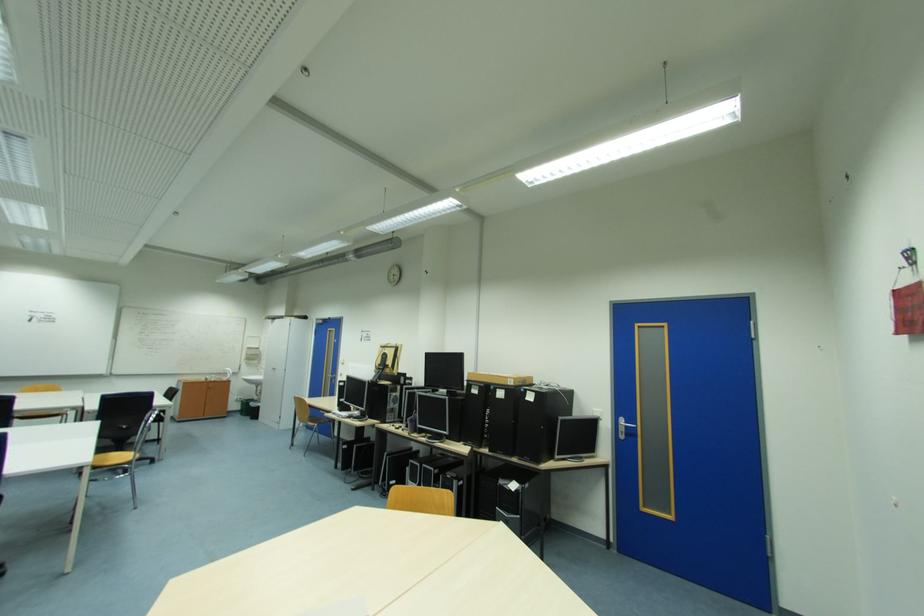
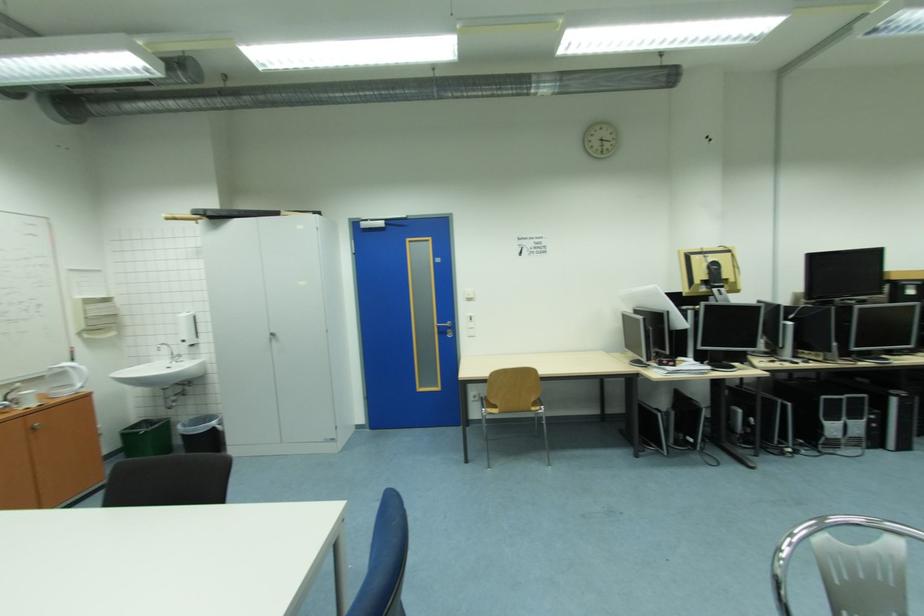
Find the pixel in the second image that matches point (266, 405) in the first image.

(220, 424)